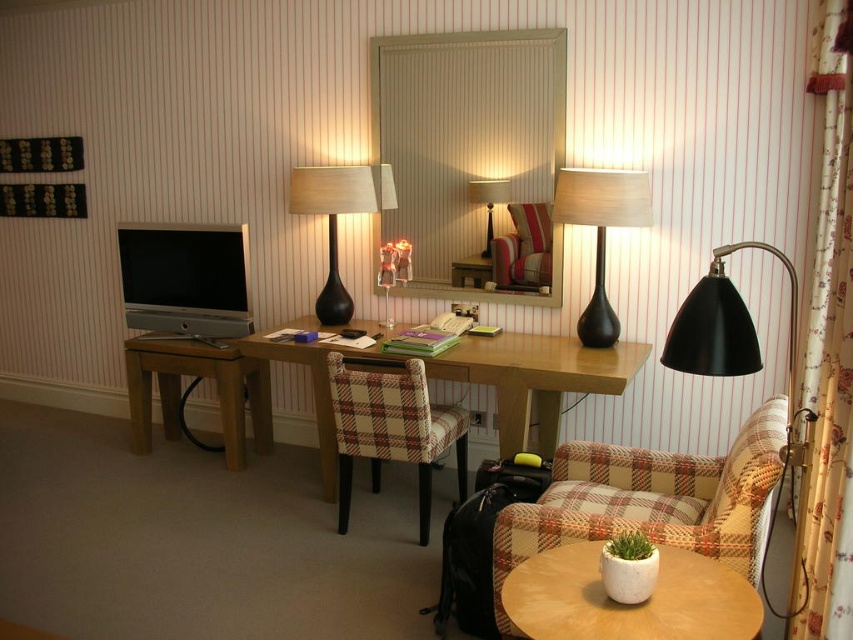
Can you confirm if white ceramic table at lower right is bigger than black glass table lamp at center?

No.

From the picture: Does white ceramic table at lower right appear on the left side of black glass table lamp at center?

In fact, white ceramic table at lower right is to the right of black glass table lamp at center.

Is point (540, 637) positioned after point (316, 168)?

That is False.

The width and height of the screenshot is (853, 640). Identify the location of white ceramic table at lower right. (628, 604).

In the scene shown: Is plaid fabric armchair at lower right positioned before black matte floor lamp at right?

No, plaid fabric armchair at lower right is further to the viewer.

Is plaid fabric armchair at lower right to the right of black matte floor lamp at right from the viewer's perspective?

Incorrect, plaid fabric armchair at lower right is not on the right side of black matte floor lamp at right.

Is point (751, 532) farther from viewer compared to point (796, 314)?

No, (751, 532) is in front of (796, 314).

At what (x,y) coordinates should I click in order to perform the action: click on plaid fabric armchair at lower right. Please return your answer as a coordinate pair (x, y). The image size is (853, 640). Looking at the image, I should click on (651, 500).

Is wooden desk at center taller than matte black lamp at center?

Correct, wooden desk at center is much taller as matte black lamp at center.

Does wooden desk at center have a greater width compared to matte black lamp at center?

Correct, the width of wooden desk at center exceeds that of matte black lamp at center.

This screenshot has height=640, width=853. What do you see at coordinates (535, 378) in the screenshot? I see `wooden desk at center` at bounding box center [535, 378].

Image resolution: width=853 pixels, height=640 pixels. I want to click on wooden desk at center, so click(535, 378).